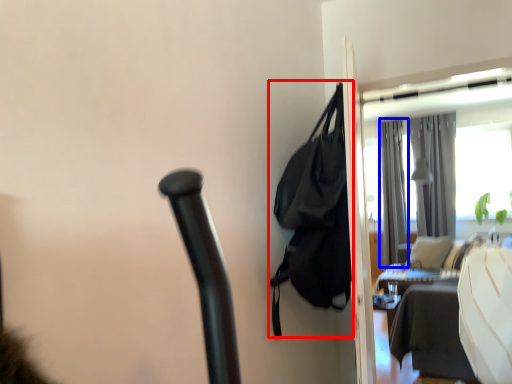
Question: Which point is further to the camera, bag (highlighted by a red box) or curtain (highlighted by a blue box)?

Choices:
 (A) bag
 (B) curtain

Answer: (B)